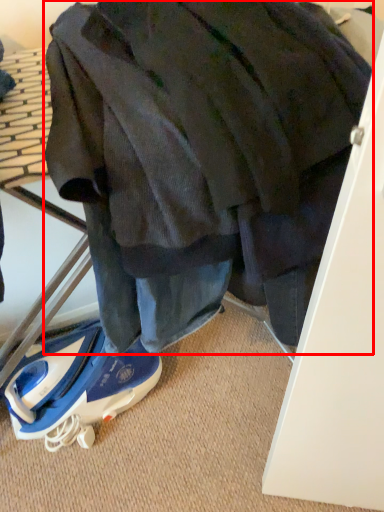
Question: Considering the relative positions of jacket (annotated by the red box) and footwear in the image provided, where is jacket (annotated by the red box) located with respect to the staircase?

Choices:
 (A) left
 (B) right

Answer: (B)